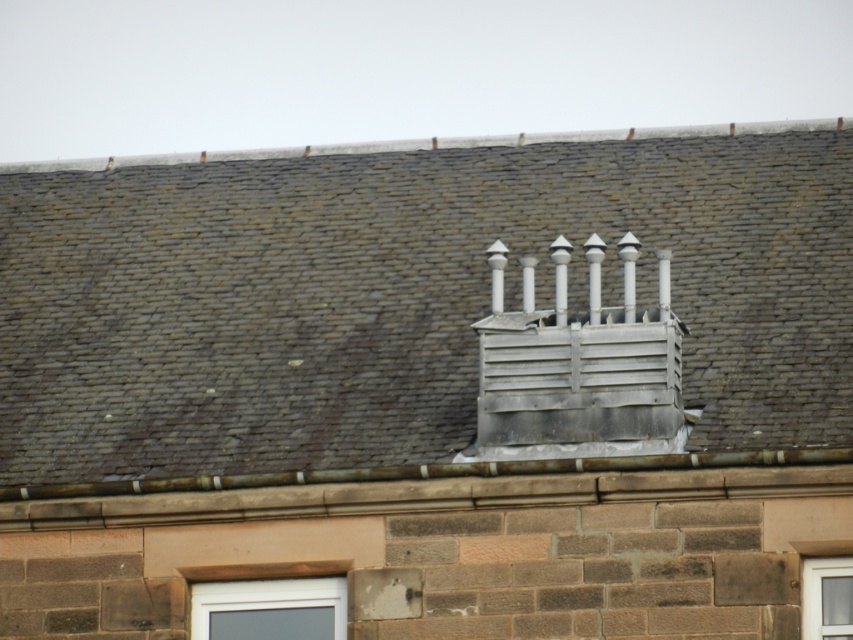
Does white plastic window at lower center appear on the right side of clear glass window at center?

Incorrect, white plastic window at lower center is not on the right side of clear glass window at center.

Is the position of white plastic window at lower center more distant than that of clear glass window at center?

Yes.

This screenshot has height=640, width=853. I want to click on white plastic window at lower center, so click(x=270, y=609).

Locate an element on the screen. Image resolution: width=853 pixels, height=640 pixels. white plastic window at lower center is located at coordinates (270, 609).

Between metallic gray vent at center and clear glass window at center, which one has more height?

metallic gray vent at center

Is metallic gray vent at center taller than clear glass window at center?

Indeed, metallic gray vent at center has a greater height compared to clear glass window at center.

Locate an element on the screen. The height and width of the screenshot is (640, 853). metallic gray vent at center is located at coordinates (426, 308).

Can you confirm if metallic gray vent at center is shorter than white plastic window at lower center?

No, metallic gray vent at center is not shorter than white plastic window at lower center.

Who is higher up, metallic gray vent at center or white plastic window at lower center?

Positioned higher is metallic gray vent at center.

Is point (849, 355) less distant than point (293, 584)?

No, (849, 355) is further to viewer.

The height and width of the screenshot is (640, 853). I want to click on metallic gray vent at center, so click(x=426, y=308).